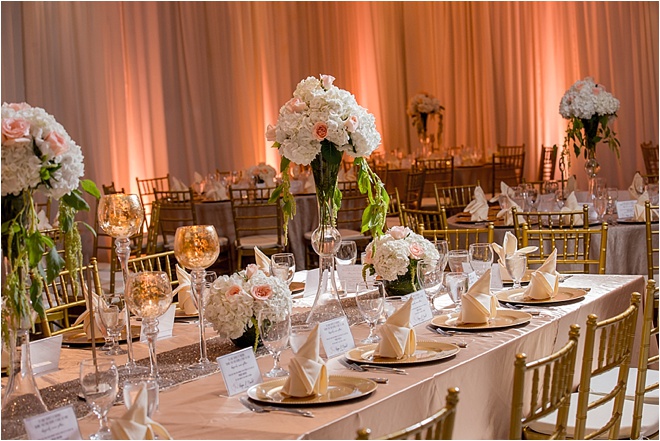
The width and height of the screenshot is (660, 441). Identify the location of glass flower vases. (24, 390), (331, 297), (587, 177), (424, 145).